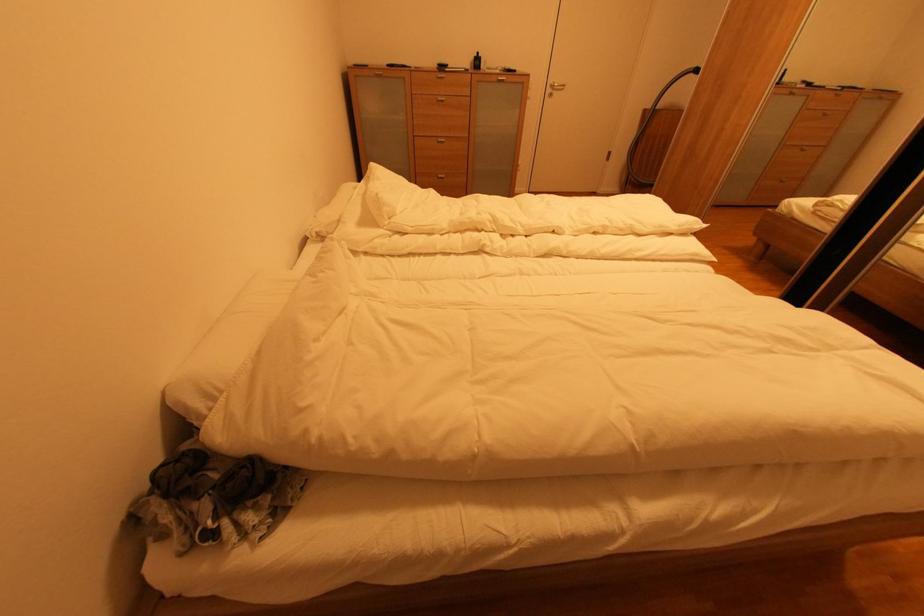
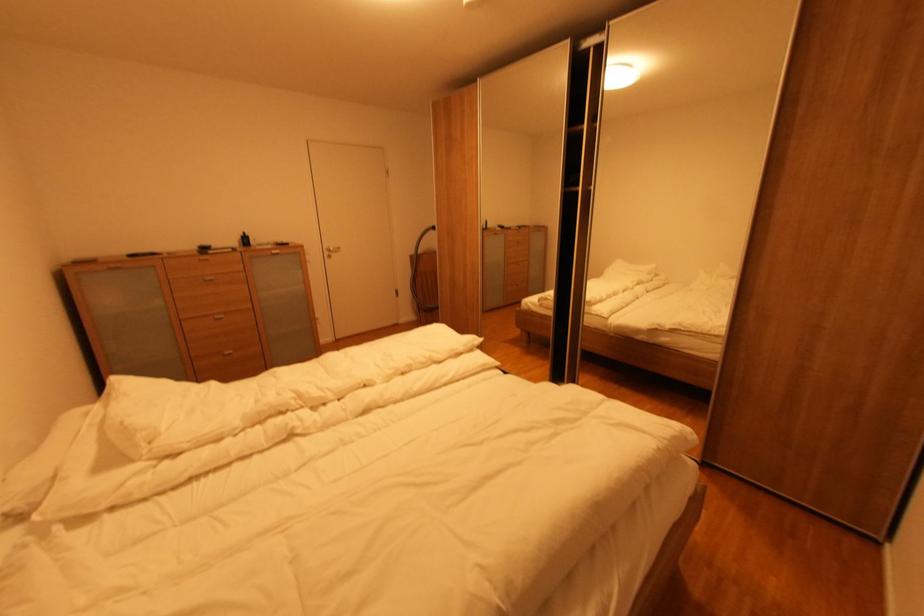
Where in the second image is the point corresponding to pixel 481 55 from the first image?

(248, 237)